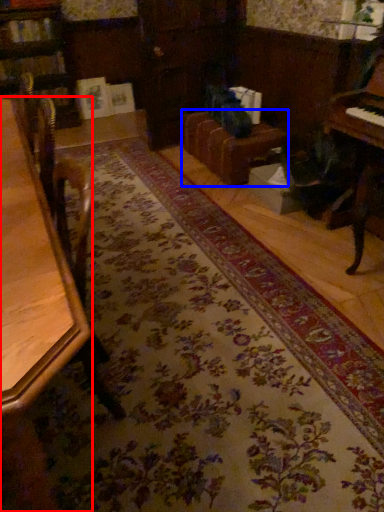
Question: Which of the following is the farthest to the observer, table (highlighted by a red box) or couch (highlighted by a blue box)?

Choices:
 (A) table
 (B) couch

Answer: (B)